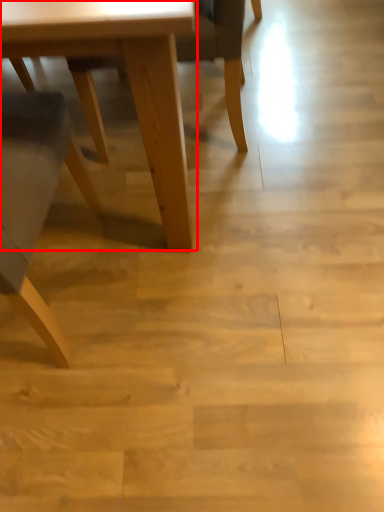
Question: From the image's perspective, what is the correct spatial relationship of table (annotated by the red box) in relation to chair?

Choices:
 (A) below
 (B) above

Answer: (A)